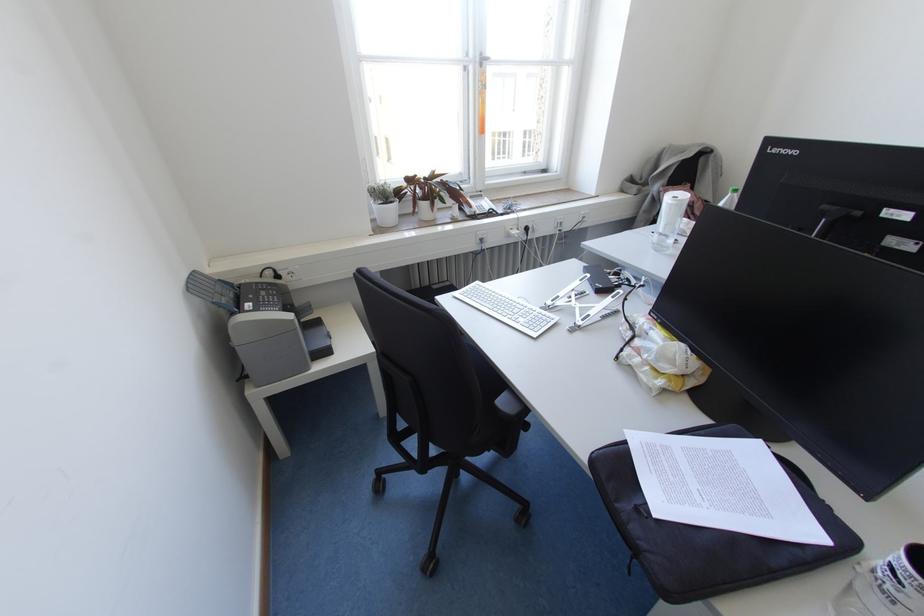
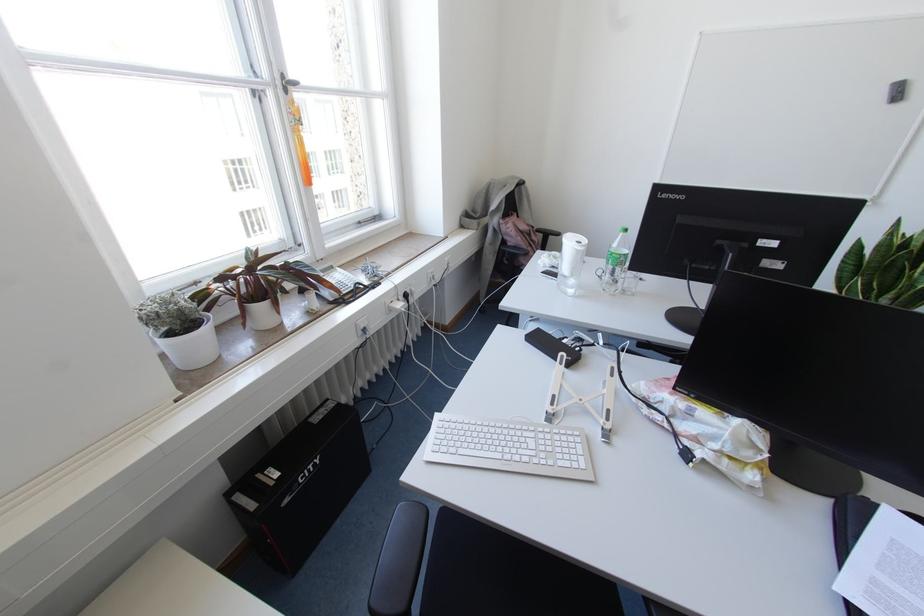
Find the pixel in the second image that matches point 431,204 in the first image.

(274, 302)